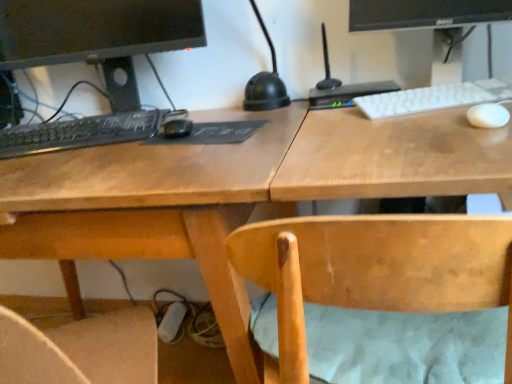
Find the location of a particular element. The width and height of the screenshot is (512, 384). vacant space that is to the left of white matte keyboard at upper right, the second computer keyboard in the left-to-right sequence is located at coordinates (325, 122).